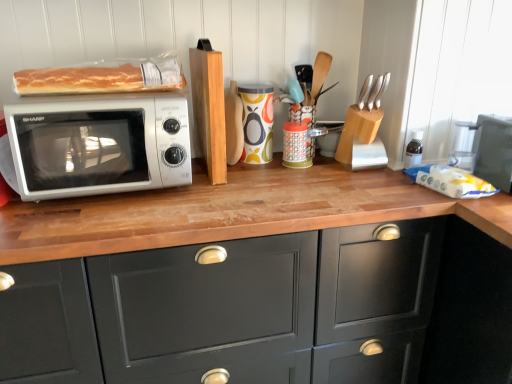
Question: Does matte black cabinet at center have a lesser width compared to wooden knife block at upper right, placed as the third appliance when sorted from left to right?

Choices:
 (A) yes
 (B) no

Answer: (B)

Question: Can you confirm if matte black cabinet at center is taller than wooden knife block at upper right, the second appliance viewed from the right?

Choices:
 (A) no
 (B) yes

Answer: (B)

Question: Is matte black cabinet at center looking in the opposite direction of wooden knife block at upper right, placed as the third appliance when sorted from left to right?

Choices:
 (A) no
 (B) yes

Answer: (A)

Question: From a real-world perspective, is matte black cabinet at center on top of wooden knife block at upper right, the second appliance viewed from the right?

Choices:
 (A) yes
 (B) no

Answer: (B)

Question: Is matte black cabinet at center wider than wooden knife block at upper right, placed as the third appliance when sorted from left to right?

Choices:
 (A) yes
 (B) no

Answer: (A)

Question: Can you confirm if matte black cabinet at center is positioned to the left of wooden knife block at upper right, the second appliance viewed from the right?

Choices:
 (A) no
 (B) yes

Answer: (B)

Question: Could you tell me if colorful ceramic mug at center, the first appliance from the left, is facing light brown wooden block at center?

Choices:
 (A) no
 (B) yes

Answer: (A)

Question: Is colorful ceramic mug at center, the first appliance from the left, outside light brown wooden block at center?

Choices:
 (A) yes
 (B) no

Answer: (A)

Question: Are colorful ceramic mug at center, which ranks as the 4th appliance in right-to-left order, and light brown wooden block at center beside each other?

Choices:
 (A) no
 (B) yes

Answer: (A)

Question: From the image's perspective, is colorful ceramic mug at center, the first appliance from the left, above light brown wooden block at center?

Choices:
 (A) no
 (B) yes

Answer: (A)

Question: Is colorful ceramic mug at center, which ranks as the 4th appliance in right-to-left order, taller than light brown wooden block at center?

Choices:
 (A) no
 (B) yes

Answer: (A)

Question: Is colorful ceramic mug at center, the first appliance from the left, bigger than light brown wooden block at center?

Choices:
 (A) no
 (B) yes

Answer: (A)

Question: Does matte black toaster oven at right, acting as the 1th appliance starting from the right, have a lesser height compared to matte black cabinet at center?

Choices:
 (A) yes
 (B) no

Answer: (A)